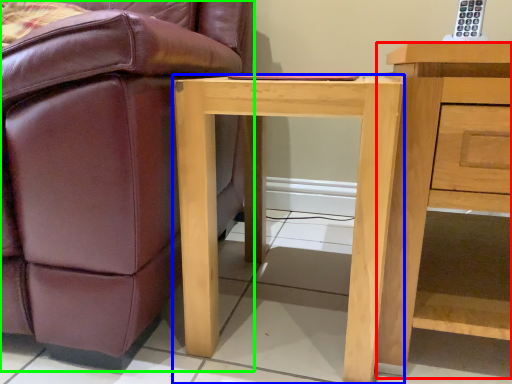
Question: Which object is the farthest from nightstand (highlighted by a red box)? Choose among these: desk (highlighted by a blue box) or chair (highlighted by a green box).

Choices:
 (A) desk
 (B) chair

Answer: (B)